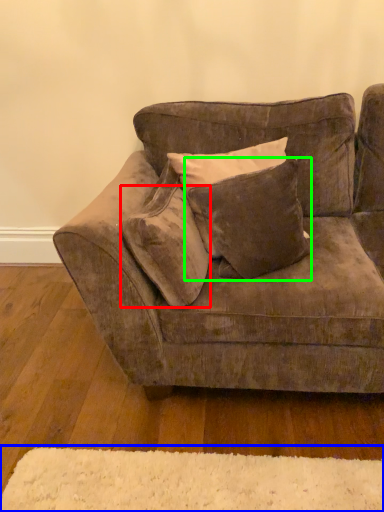
Question: Estimate the real-world distances between objects in this image. Which object is closer to pillow (highlighted by a red box), mat (highlighted by a blue box) or pillow (highlighted by a green box)?

Choices:
 (A) mat
 (B) pillow

Answer: (B)